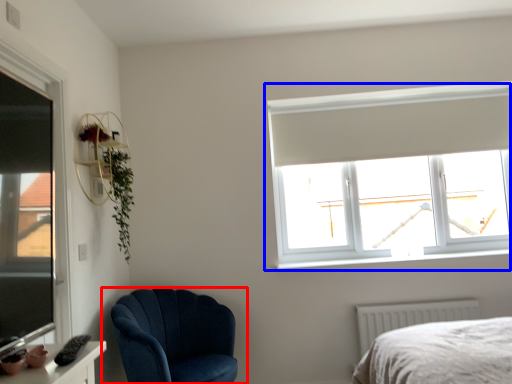
Question: Which point is further to the camera, chair (highlighted by a red box) or window (highlighted by a blue box)?

Choices:
 (A) chair
 (B) window

Answer: (B)